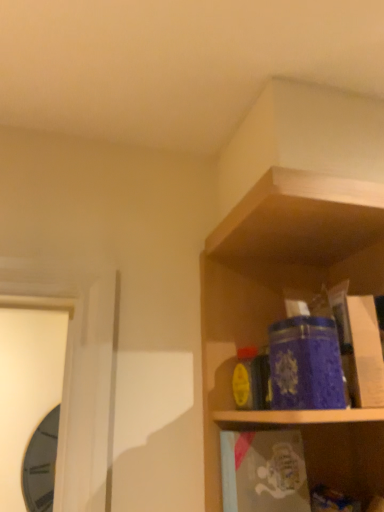
Locate an element on the screen. The width and height of the screenshot is (384, 512). blue textured glass jar at upper right is located at coordinates (306, 364).

Describe the element at coordinates (306, 364) in the screenshot. I see `blue textured glass jar at upper right` at that location.

You are a GUI agent. You are given a task and a screenshot of the screen. Output one action in this format:
    pyautogui.click(x=<x>, y=<y>)
    Task: Click on the blue textured glass jar at upper right
    The image size is (384, 512).
    Given the screenshot: What is the action you would take?
    pyautogui.click(x=306, y=364)